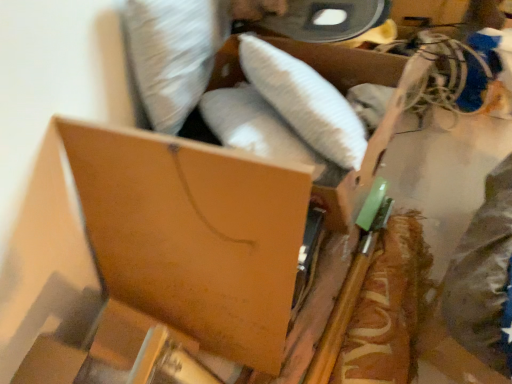
Question: Does brown cardboard box at center, the 1th storage box in the bottom-to-top sequence, come behind brown cardboard box at upper center, acting as the 2th storage box starting from the bottom?

Choices:
 (A) no
 (B) yes

Answer: (A)

Question: Can you see brown cardboard box at center, the 1th storage box in the bottom-to-top sequence, touching brown cardboard box at upper center, acting as the 2th storage box starting from the bottom?

Choices:
 (A) yes
 (B) no

Answer: (B)

Question: Is brown cardboard box at center, the 1th storage box in the bottom-to-top sequence, to the right of brown cardboard box at upper center, acting as the 2th storage box starting from the bottom, from the viewer's perspective?

Choices:
 (A) yes
 (B) no

Answer: (B)

Question: Considering the relative positions of brown cardboard box at center, which is the 2th storage box from top to bottom, and brown cardboard box at upper center, which ranks as the first storage box in top-to-bottom order, in the image provided, is brown cardboard box at center, which is the 2th storage box from top to bottom, in front of brown cardboard box at upper center, which ranks as the first storage box in top-to-bottom order,?

Choices:
 (A) no
 (B) yes

Answer: (B)

Question: Considering the relative positions of brown cardboard box at center, the 1th storage box in the bottom-to-top sequence, and brown cardboard box at upper center, acting as the 2th storage box starting from the bottom, in the image provided, is brown cardboard box at center, the 1th storage box in the bottom-to-top sequence, to the left of brown cardboard box at upper center, acting as the 2th storage box starting from the bottom, from the viewer's perspective?

Choices:
 (A) no
 (B) yes

Answer: (B)

Question: From a real-world perspective, is brown cardboard box at center, which is the 2th storage box from top to bottom, below brown cardboard box at upper center, acting as the 2th storage box starting from the bottom?

Choices:
 (A) no
 (B) yes

Answer: (B)

Question: From the image's perspective, would you say wooden spatula at right is shown under brown cardboard box at upper center, acting as the 2th storage box starting from the bottom?

Choices:
 (A) no
 (B) yes

Answer: (B)

Question: Is wooden spatula at right at the left side of brown cardboard box at upper center, acting as the 2th storage box starting from the bottom?

Choices:
 (A) no
 (B) yes

Answer: (A)

Question: Considering the relative sizes of wooden spatula at right and brown cardboard box at upper center, which ranks as the first storage box in top-to-bottom order, in the image provided, is wooden spatula at right bigger than brown cardboard box at upper center, which ranks as the first storage box in top-to-bottom order,?

Choices:
 (A) no
 (B) yes

Answer: (A)

Question: Would you consider wooden spatula at right to be distant from brown cardboard box at upper center, acting as the 2th storage box starting from the bottom?

Choices:
 (A) no
 (B) yes

Answer: (A)

Question: Is wooden spatula at right further to camera compared to brown cardboard box at upper center, acting as the 2th storage box starting from the bottom?

Choices:
 (A) no
 (B) yes

Answer: (B)

Question: Can you confirm if wooden spatula at right is shorter than brown cardboard box at upper center, acting as the 2th storage box starting from the bottom?

Choices:
 (A) no
 (B) yes

Answer: (B)

Question: Is brown cardboard box at center, the 1th storage box in the bottom-to-top sequence, located within wooden spatula at right?

Choices:
 (A) no
 (B) yes

Answer: (A)